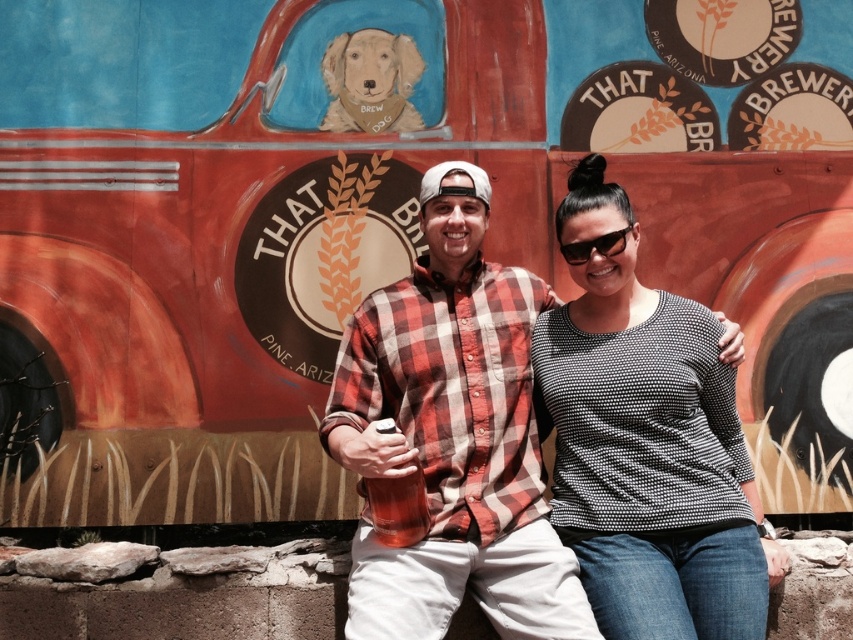
Question: Is plaid cotton shirt at center above black plastic sunglasses at center?

Choices:
 (A) yes
 (B) no

Answer: (B)

Question: Which point appears closest to the camera in this image?

Choices:
 (A) (511, 342)
 (B) (654, 308)
 (C) (381, 58)
 (D) (613, 230)

Answer: (D)

Question: Which point is closer to the camera?

Choices:
 (A) (612, 250)
 (B) (471, 493)

Answer: (B)

Question: Is golden fur dog at upper center to the right of black plastic sunglasses at center from the viewer's perspective?

Choices:
 (A) yes
 (B) no

Answer: (B)

Question: Is black dotted sweater at center above black plastic sunglasses at center?

Choices:
 (A) no
 (B) yes

Answer: (A)

Question: Which point is farther from the camera taking this photo?

Choices:
 (A) (718, 508)
 (B) (630, 225)
 (C) (363, 77)

Answer: (C)